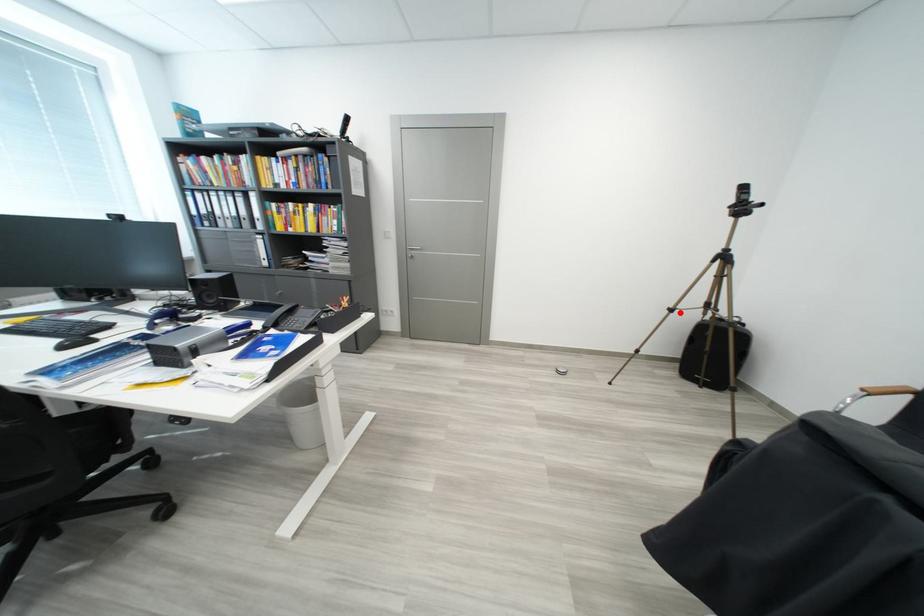
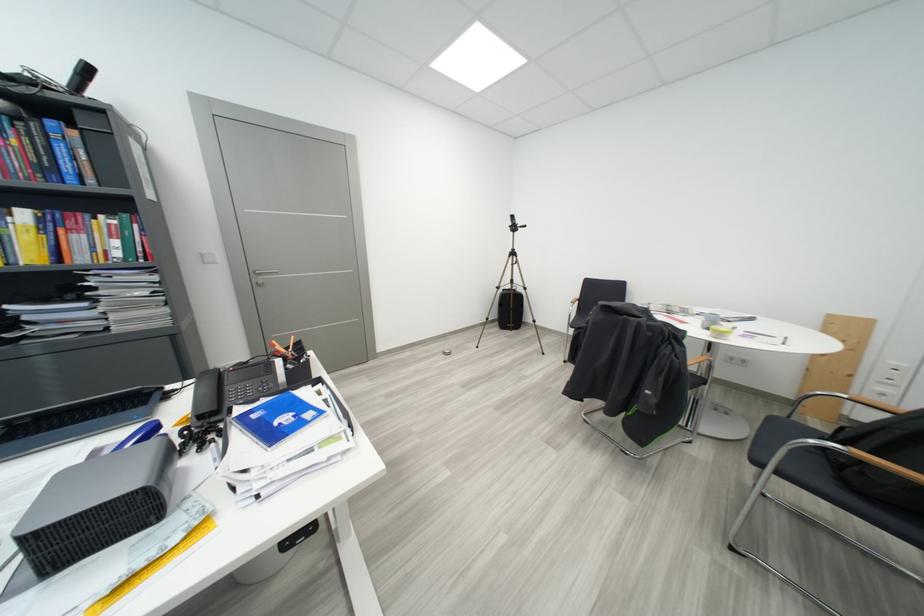
In the second image, find the point that corresponds to the highlighted location in the first image.

(506, 291)